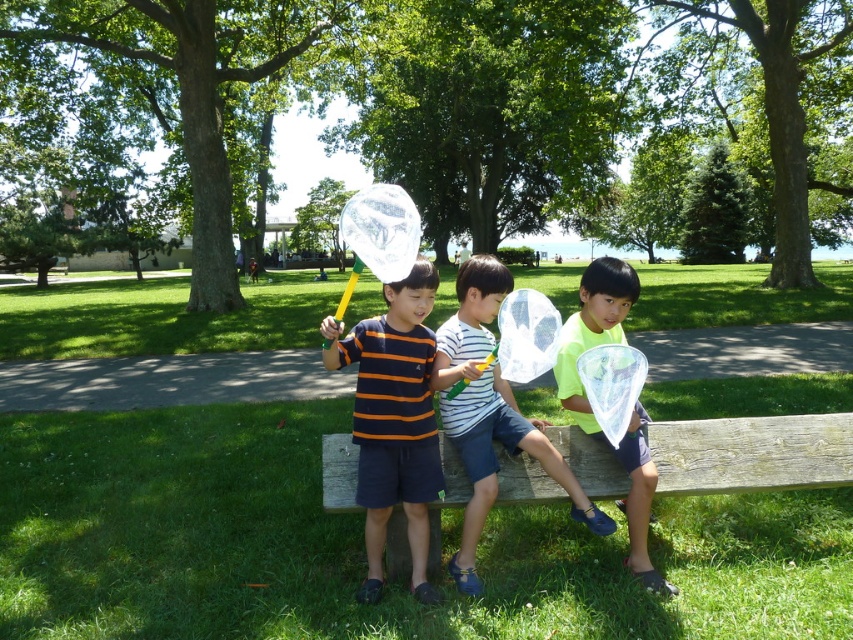
You are a photographer standing in the park and want to take a photo of the wooden bench at center and the striped cotton shirt at center. Which object will appear closer to you in the photo?

The wooden bench at center will appear closer to you in the photo because it is further to the viewer than the striped cotton shirt at center.